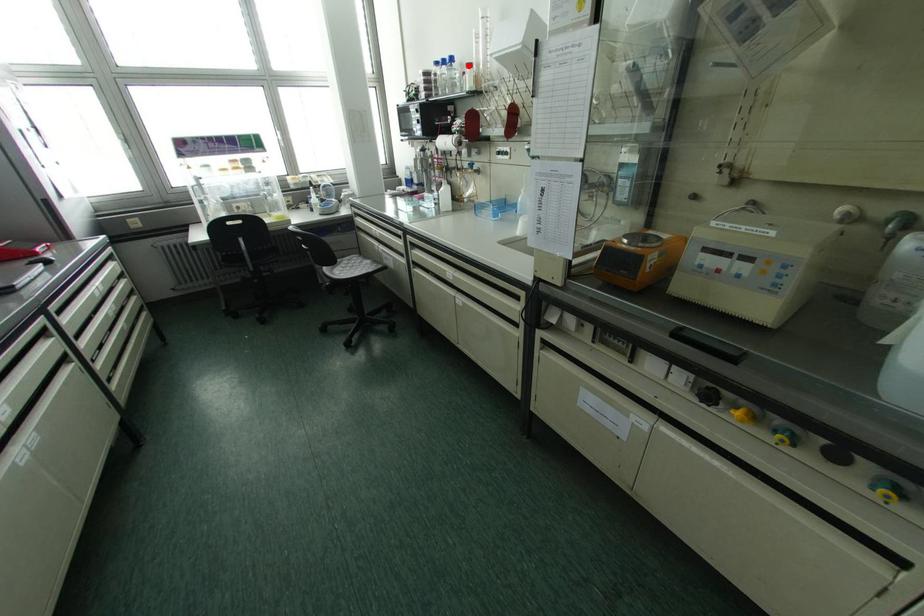
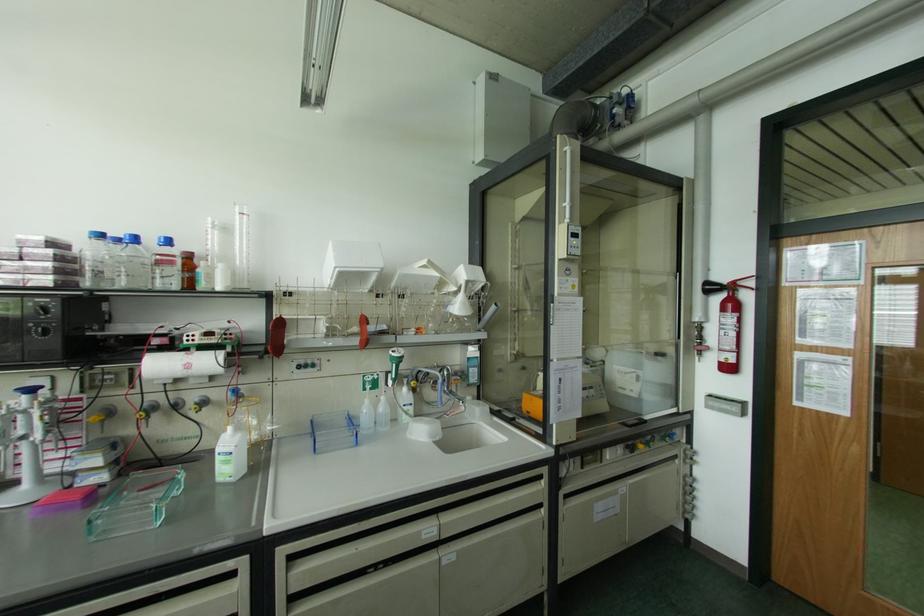
Find the pixel in the second image that matches the highlighted location in the first image.

(188, 256)